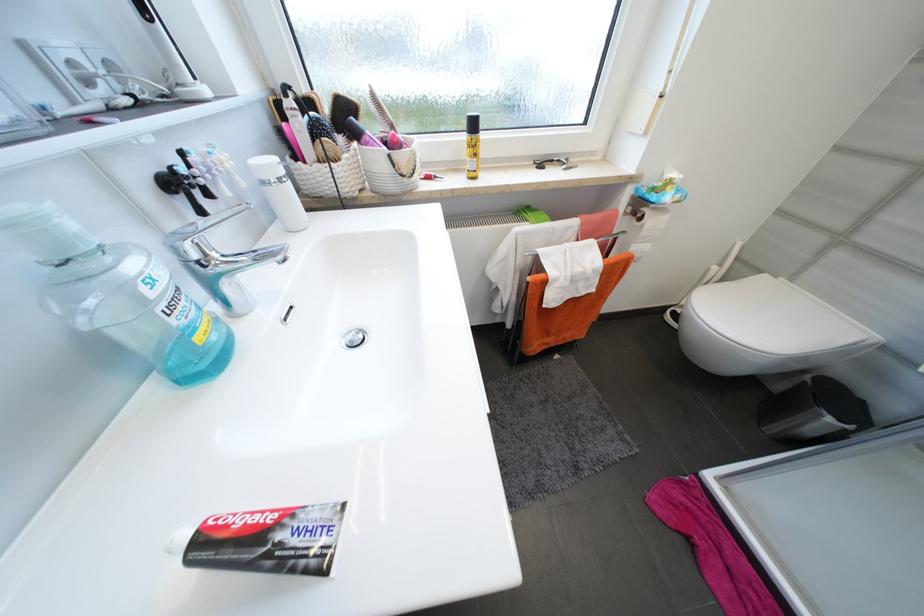
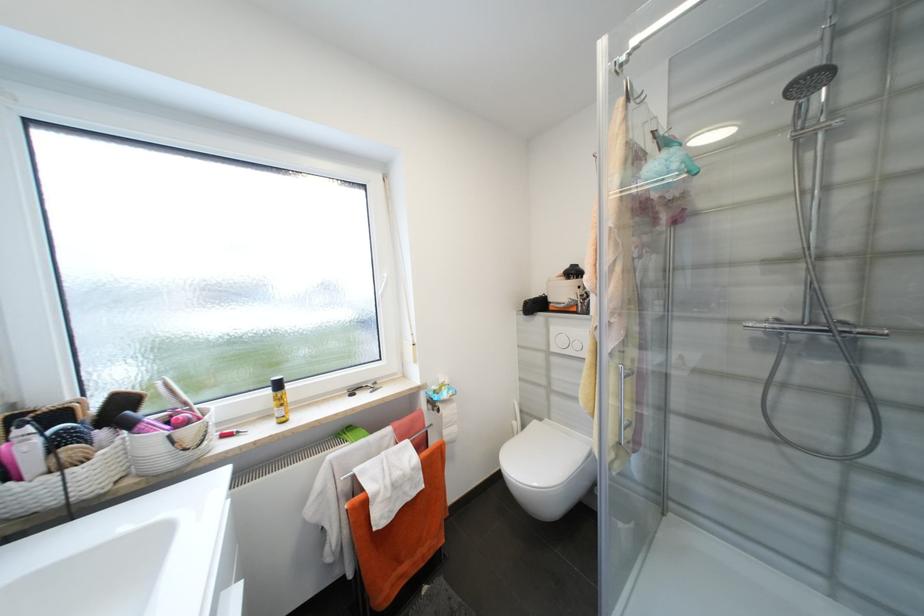
Find the pixel in the second image that matches point 480,127 in the first image.

(284, 386)